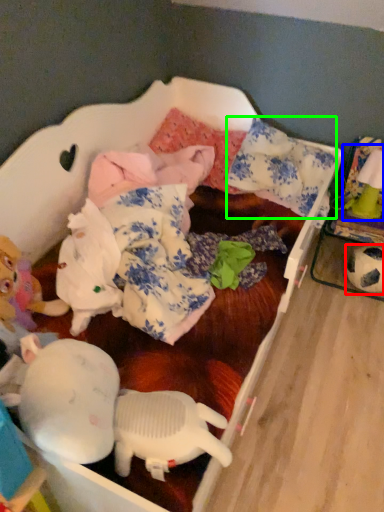
Question: Based on their relative distances, which object is nearer to toy (highlighted by a red box)? Choose from toy (highlighted by a blue box) and pillow (highlighted by a green box).

Choices:
 (A) toy
 (B) pillow

Answer: (A)